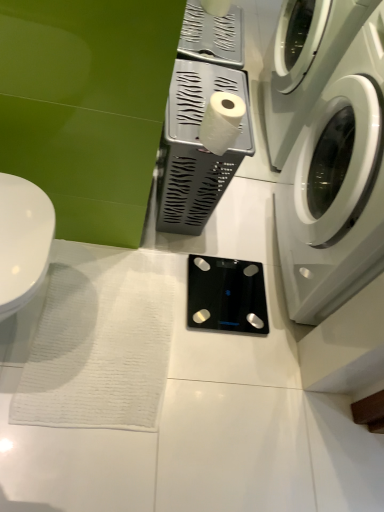
Locate an element on the screen. The image size is (384, 512). vacant space to the right of white plastic tissue holder at center, which appears as the 2th appliance when ordered from the bottom is located at coordinates point(239,225).